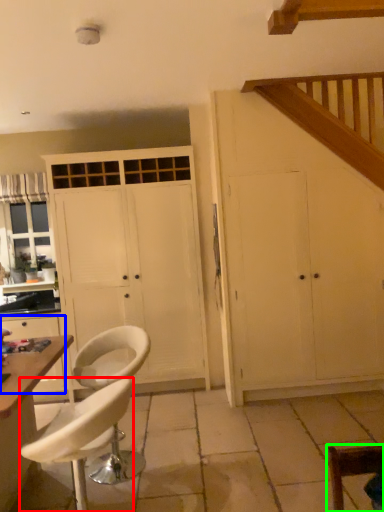
Question: Estimate the real-world distances between objects in this image. Which object is closer to chair (highlighted by a red box), cabinetry (highlighted by a blue box) or chair (highlighted by a green box)?

Choices:
 (A) cabinetry
 (B) chair

Answer: (B)